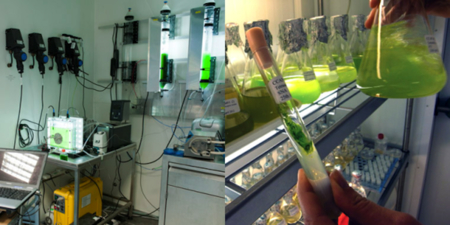
I want to click on table, so click(x=83, y=162).